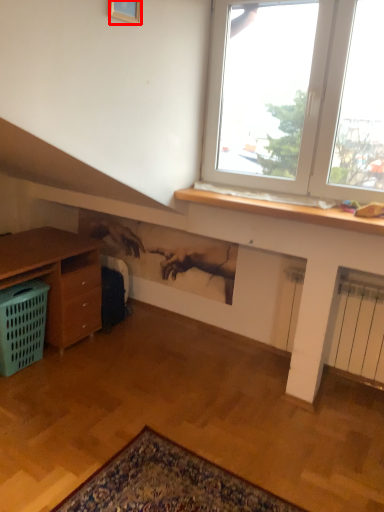
Question: Observing the image, what is the correct spatial positioning of picture frame (annotated by the red box) in reference to basket?

Choices:
 (A) right
 (B) left

Answer: (A)